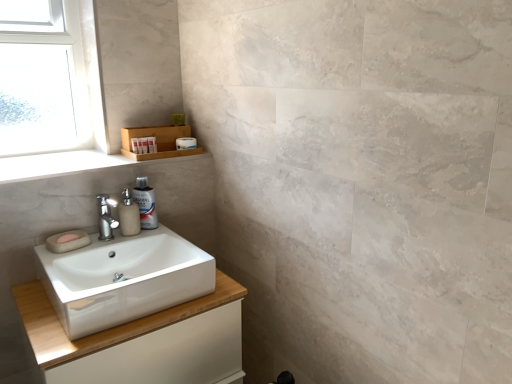
Question: Is white matte toilet paper at upper center facing towards translucent plastic spray bottle at sink?

Choices:
 (A) yes
 (B) no

Answer: (B)

Question: Is white matte toilet paper at upper center not close to translucent plastic spray bottle at sink?

Choices:
 (A) no
 (B) yes

Answer: (A)

Question: Is the depth of white matte toilet paper at upper center less than that of translucent plastic spray bottle at sink?

Choices:
 (A) yes
 (B) no

Answer: (B)

Question: Can you confirm if white matte toilet paper at upper center is bigger than translucent plastic spray bottle at sink?

Choices:
 (A) no
 (B) yes

Answer: (A)

Question: Is white matte toilet paper at upper center positioned with its back to translucent plastic spray bottle at sink?

Choices:
 (A) yes
 (B) no

Answer: (B)

Question: Is white matte toilet paper at upper center smaller than translucent plastic spray bottle at sink?

Choices:
 (A) yes
 (B) no

Answer: (A)

Question: From a real-world perspective, is matte beige soap at left under clear glass window at upper left?

Choices:
 (A) yes
 (B) no

Answer: (A)

Question: Considering the relative sizes of matte beige soap at left and clear glass window at upper left in the image provided, is matte beige soap at left thinner than clear glass window at upper left?

Choices:
 (A) no
 (B) yes

Answer: (B)

Question: Does matte beige soap at left have a greater width compared to clear glass window at upper left?

Choices:
 (A) no
 (B) yes

Answer: (A)

Question: Is matte beige soap at left next to clear glass window at upper left?

Choices:
 (A) yes
 (B) no

Answer: (B)

Question: Can you confirm if matte beige soap at left is positioned to the right of clear glass window at upper left?

Choices:
 (A) no
 (B) yes

Answer: (B)

Question: Can you confirm if matte beige soap at left is shorter than clear glass window at upper left?

Choices:
 (A) yes
 (B) no

Answer: (A)

Question: From the image's perspective, does white matte container at upper left, which is counted as the 2th toiletry, starting from the right, appear lower than wooden shelf at upper left?

Choices:
 (A) no
 (B) yes

Answer: (B)